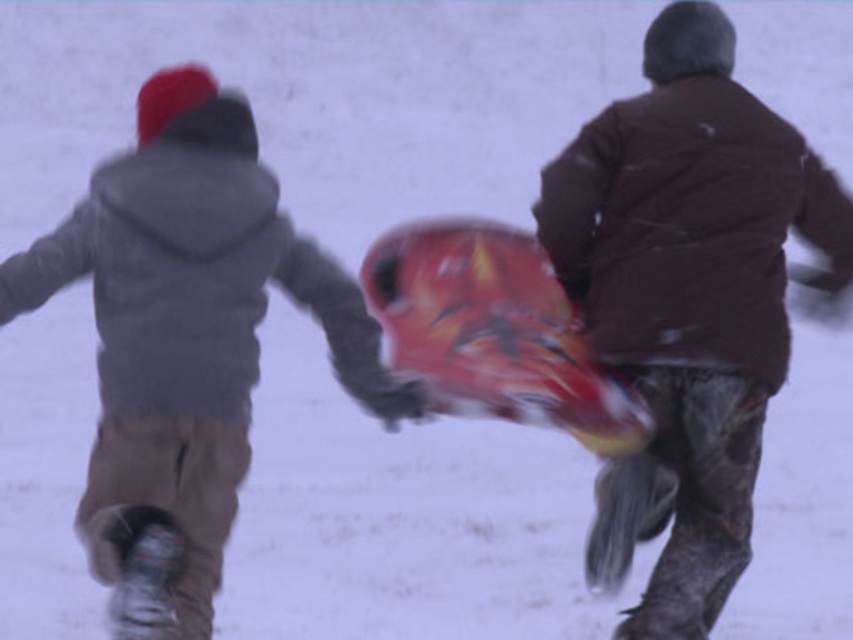
Where is the brown matte jacket at center located in the image?

The brown matte jacket at center is located at point (688, 300) in the image.

What is the exact coordinate of the brown matte jacket at center?

The brown matte jacket at center is located at point (688,300).

Based on the scene description, which object is taller between the matte gray hoodie at left and the shiny plastic snowboard at center?

The matte gray hoodie at left is much taller than the shiny plastic snowboard at center.